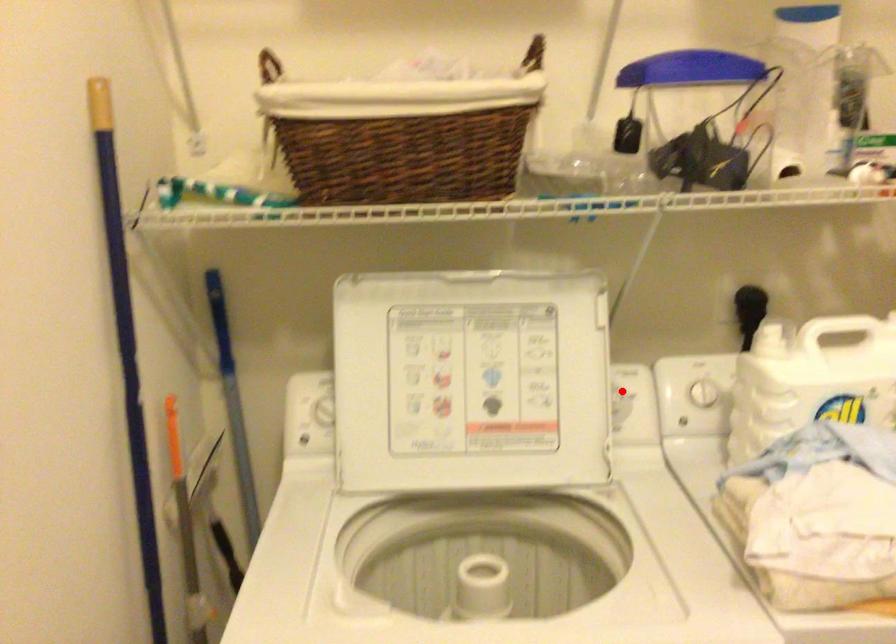
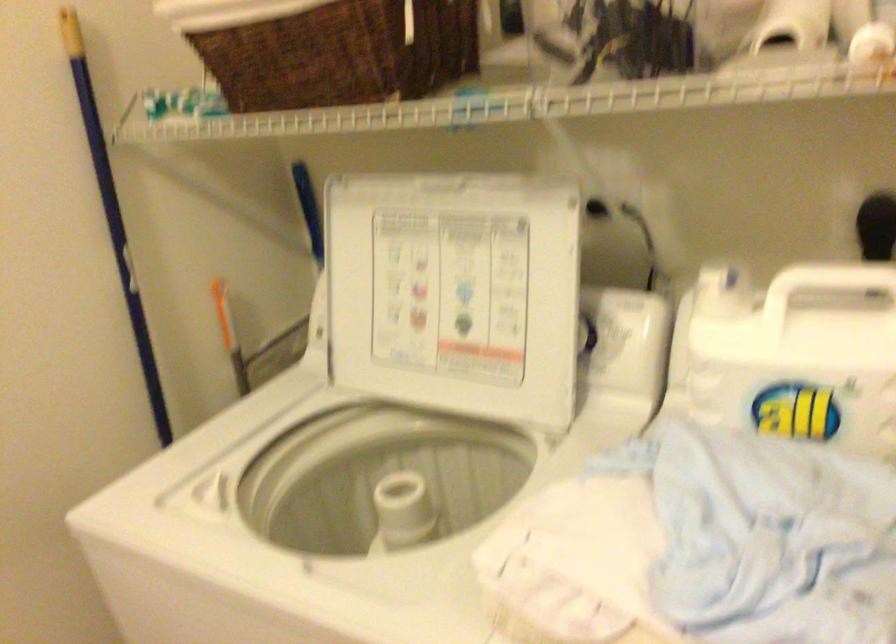
Where in the second image is the point corresponding to the highlighted location from the first image?

(616, 325)